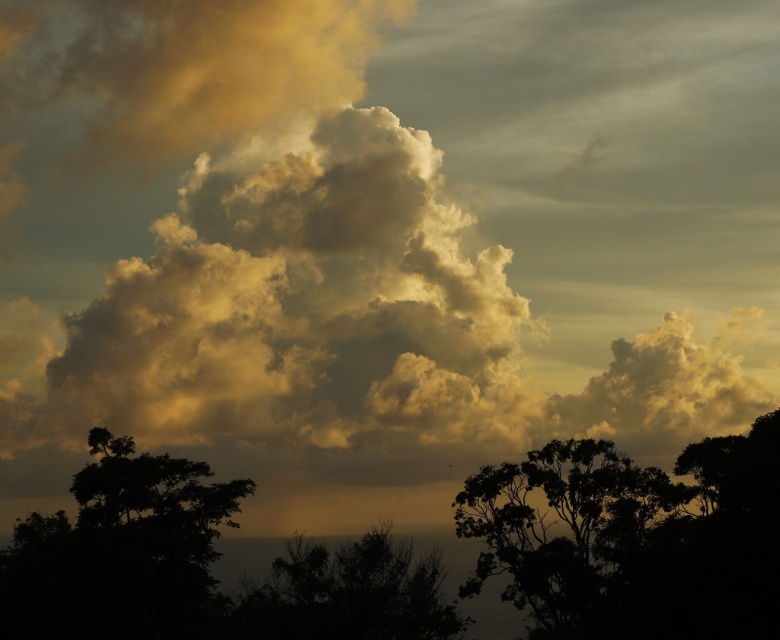
Can you confirm if silhouette leafy tree at lower right is positioned to the left of dark green leafy tree at lower left?

No, silhouette leafy tree at lower right is not to the left of dark green leafy tree at lower left.

Is silhouette leafy tree at lower right further to the viewer compared to dark green leafy tree at lower left?

No, silhouette leafy tree at lower right is in front of dark green leafy tree at lower left.

Between point (527, 589) and point (98, 595), which one is positioned in front?

Positioned in front is point (98, 595).

I want to click on silhouette leafy tree at lower right, so click(635, 538).

Based on the photo, can you confirm if dark green leafy tree at lower left is wider than dark green leafy tree at center?

Indeed, dark green leafy tree at lower left has a greater width compared to dark green leafy tree at center.

Which is in front, point (234, 497) or point (325, 632)?

Point (325, 632) is more forward.

Where is `dark green leafy tree at lower left`? dark green leafy tree at lower left is located at coordinates (119, 548).

Based on the photo, who is more forward, (x=537, y=564) or (x=367, y=552)?

Point (x=537, y=564) is more forward.

Is point (771, 449) farther from camera compared to point (360, 636)?

No, it is not.

Identify the location of silhouette leafy tree at lower right. This screenshot has width=780, height=640. (635, 538).